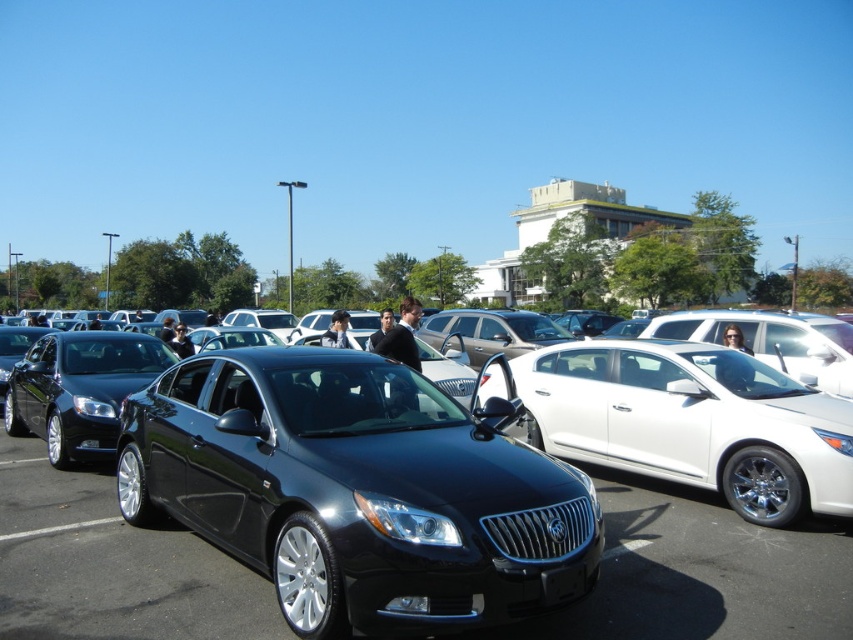
Question: Estimate the real-world distances between objects in this image. Which object is farther from the black rubber line at lower left?

Choices:
 (A) glossy black sedan at center
 (B) white glossy sedan at center

Answer: (B)

Question: Is white glossy sedan at center thinner than black rubber line at lower left?

Choices:
 (A) no
 (B) yes

Answer: (A)

Question: Which point is farther to the camera?

Choices:
 (A) glossy black sedan at center
 (B) black rubber line at lower left
 (C) white glossy sedan at center
 (D) glossy black car at center

Answer: (A)

Question: Which of the following is the farthest from the observer?

Choices:
 (A) black rubber line at lower left
 (B) glossy black sedan at center
 (C) white glossy sedan at center

Answer: (B)

Question: Does glossy black car at center have a larger size compared to white glossy sedan at center?

Choices:
 (A) yes
 (B) no

Answer: (B)

Question: Is glossy black car at center bigger than glossy black sedan at center?

Choices:
 (A) no
 (B) yes

Answer: (A)